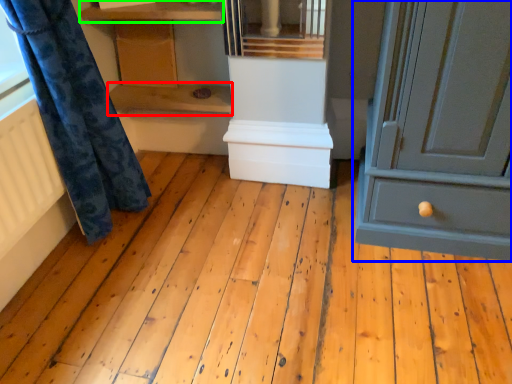
Question: Which object is positioned closest to shelf (highlighted by a red box)? Select from chest of drawers (highlighted by a blue box) and shelf (highlighted by a green box).

Choices:
 (A) chest of drawers
 (B) shelf

Answer: (B)